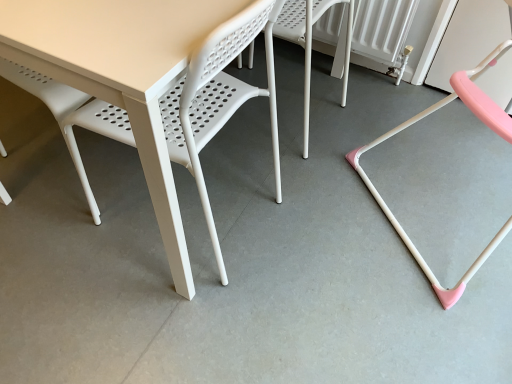
The image size is (512, 384). Find the location of `free space to the right of white plastic chair at center, the 1th chair when ordered from left to right`. free space to the right of white plastic chair at center, the 1th chair when ordered from left to right is located at coordinates (374, 116).